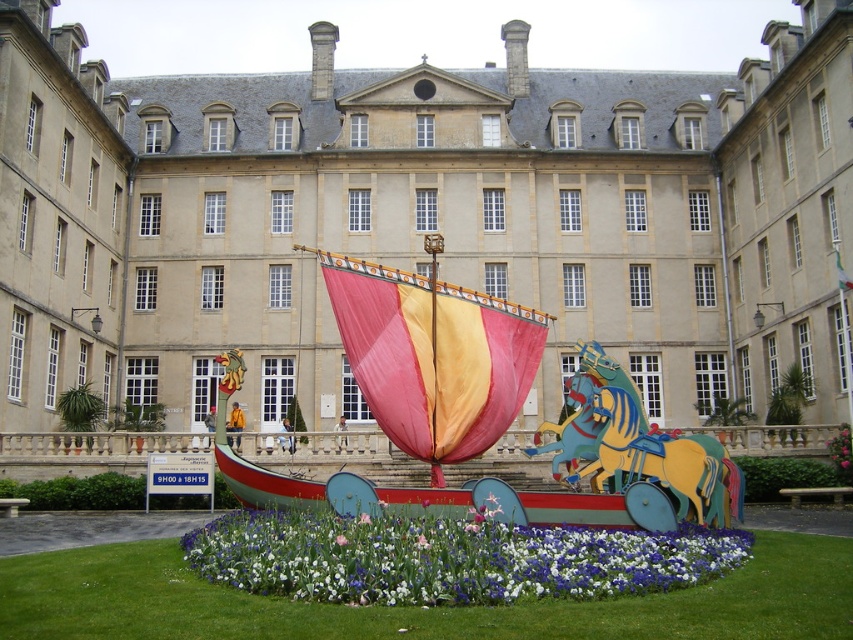
Which is more to the left, vivid floral carpet at center or pink fabric flower at center?

From the viewer's perspective, pink fabric flower at center appears more on the left side.

Can you confirm if vivid floral carpet at center is positioned above pink fabric flower at center?

No.

Is point (579, 566) behind point (344, 536)?

That is False.

You are a GUI agent. You are given a task and a screenshot of the screen. Output one action in this format:
    pyautogui.click(x=<x>, y=<y>)
    Task: Click on the vivid floral carpet at center
    The width and height of the screenshot is (853, 640).
    Given the screenshot: What is the action you would take?
    pyautogui.click(x=450, y=557)

Does multicolored fabric boat at center appear on the right side of pink fabric flower at center?

No, multicolored fabric boat at center is not to the right of pink fabric flower at center.

Is multicolored fabric boat at center to the left of pink fabric flower at center from the viewer's perspective?

Yes, multicolored fabric boat at center is to the left of pink fabric flower at center.

The width and height of the screenshot is (853, 640). Describe the element at coordinates (432, 362) in the screenshot. I see `multicolored fabric boat at center` at that location.

Locate an element on the screen. This screenshot has height=640, width=853. multicolored fabric boat at center is located at coordinates (432, 362).

Is point (392, 310) closer to viewer compared to point (24, 588)?

No.

Between multicolored fabric boat at center and green grass at center, which one appears on the left side from the viewer's perspective?

Positioned to the left is multicolored fabric boat at center.

Who is more forward, (430, 348) or (610, 614)?

Positioned in front is point (610, 614).

Where is `multicolored fabric boat at center`? multicolored fabric boat at center is located at coordinates (432, 362).